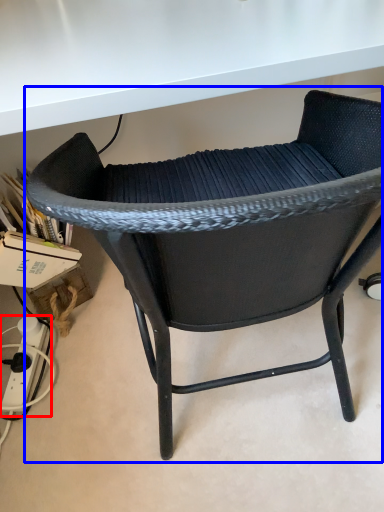
Question: Which point is closer to the camera, plug (highlighted by a red box) or chair (highlighted by a blue box)?

Choices:
 (A) plug
 (B) chair

Answer: (B)